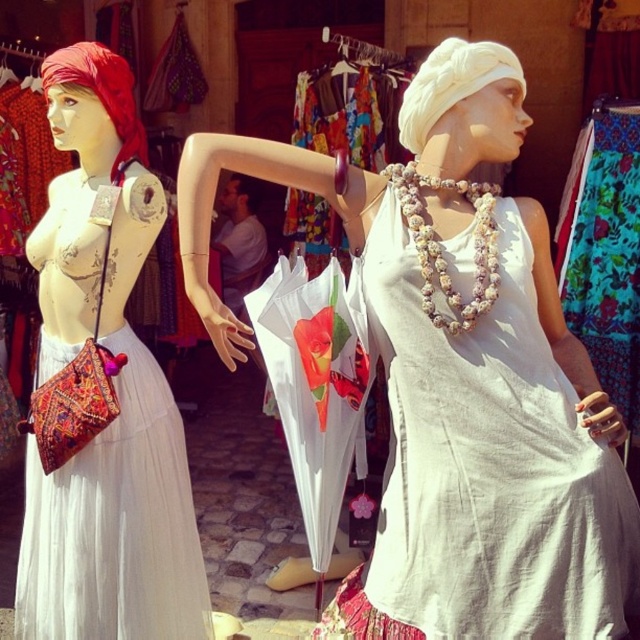
Is white fabric dress at center closer to the viewer compared to pearl-like beads necklace at center?

That is True.

Which is in front, point (474, 428) or point (442, 316)?

Positioned in front is point (474, 428).

Where is `white fabric dress at center`? white fabric dress at center is located at coordinates pyautogui.click(x=458, y=372).

Locate an element on the screen. The height and width of the screenshot is (640, 640). white fabric headscarf at upper center is located at coordinates (451, 83).

Between point (456, 36) and point (125, 148), which one is positioned behind?

Point (456, 36)

Locate an element on the screen. white fabric headscarf at upper center is located at coordinates (451, 83).

Does matte white dress at left appear over white fabric headscarf at upper center?

Actually, matte white dress at left is below white fabric headscarf at upper center.

Between point (125, 205) and point (452, 58), which one is positioned in front?

Point (452, 58) is more forward.

Is point (84, 420) farther from camera compared to point (488, 45)?

Yes, it is behind point (488, 45).

Find the location of a particular element. This screenshot has width=640, height=640. matte white dress at left is located at coordinates (102, 388).